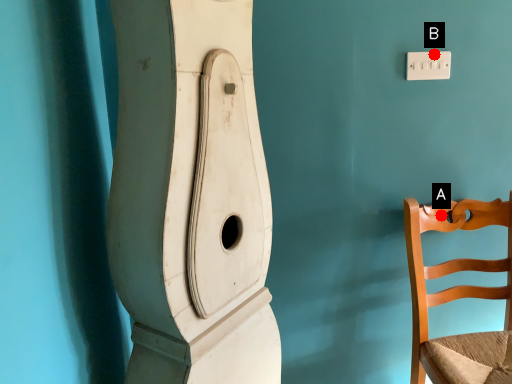
Question: Two points are circled on the image, labeled by A and B beside each circle. Which point appears farthest from the camera in this image?

Choices:
 (A) A is further
 (B) B is further

Answer: (A)